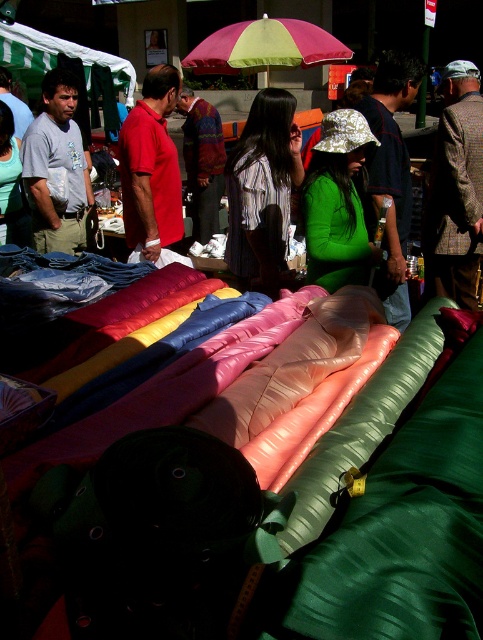
Question: Observing the image, what is the correct spatial positioning of striped shirt at center in reference to matte red polo shirt at left?

Choices:
 (A) below
 (B) above

Answer: (A)

Question: Considering the real-world distances, which object is closest to the yellow-green fabric umbrella at upper center?

Choices:
 (A) matte red polo shirt at left
 (B) striped shirt at center

Answer: (A)

Question: Which of the following is the farthest from the observer?

Choices:
 (A) striped shirt at center
 (B) yellow-green fabric umbrella at upper center

Answer: (B)

Question: From the image, what is the correct spatial relationship of striped shirt at center in relation to matte red polo shirt at left?

Choices:
 (A) right
 (B) left

Answer: (A)

Question: Is striped shirt at center positioned behind yellow-green fabric umbrella at upper center?

Choices:
 (A) no
 (B) yes

Answer: (A)

Question: Which point is closer to the camera?

Choices:
 (A) (281, 109)
 (B) (218, 72)

Answer: (A)